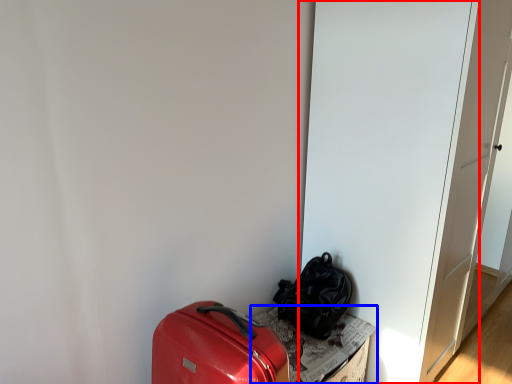
Question: Which object appears closest to the camera in this image, door (highlighted by a red box) or cardboard box (highlighted by a blue box)?

Choices:
 (A) door
 (B) cardboard box

Answer: (A)